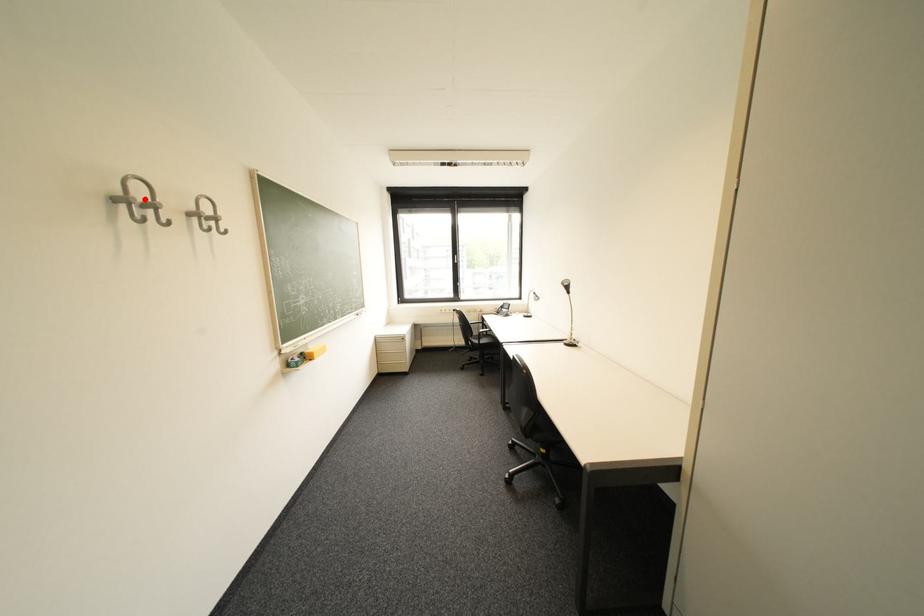
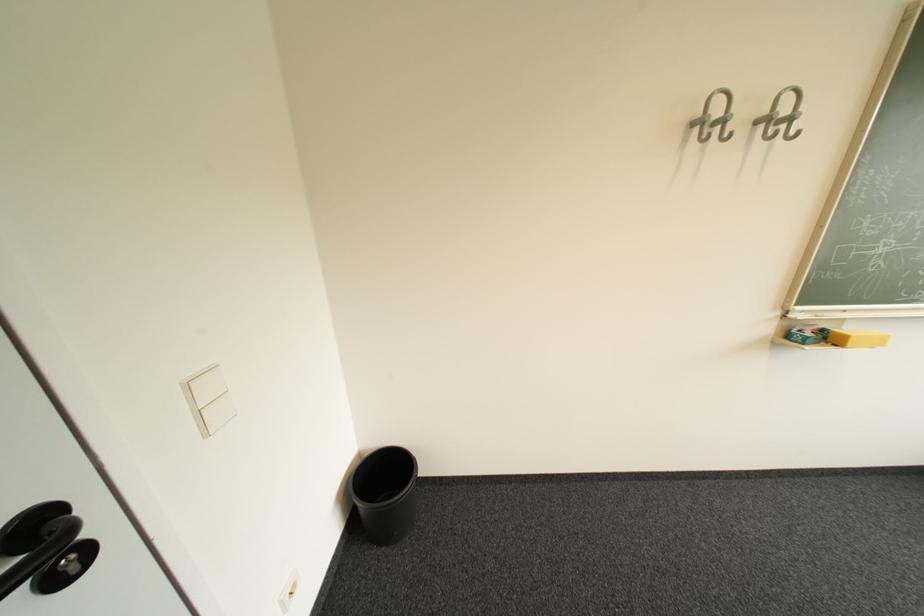
The point at the highlighted location is marked in the first image. Where is the corresponding point in the second image?

(720, 116)